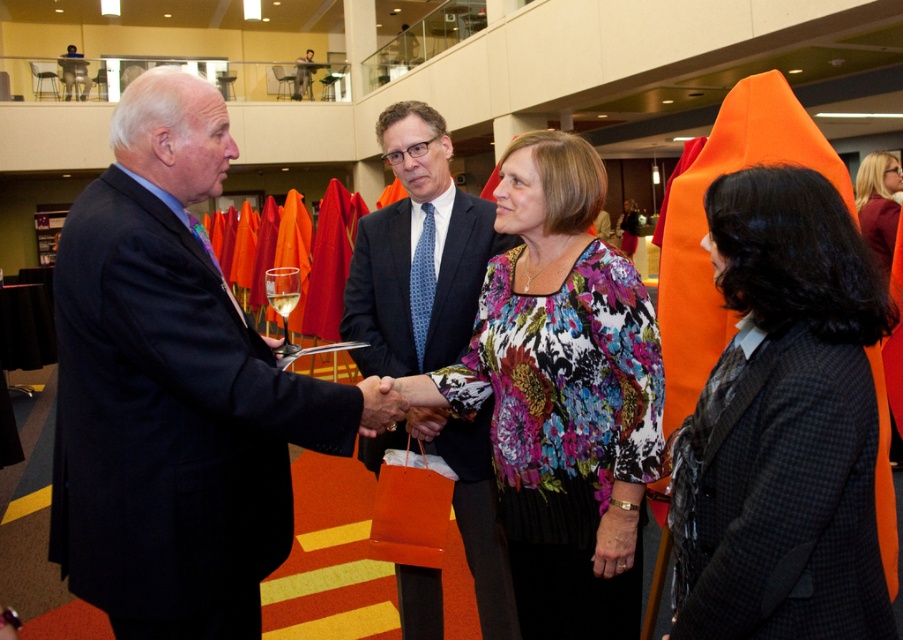
You are attending an event and see two people in the image. One is wearing a floral print blouse at center and the other has black textured hair at upper right. Which person is positioned lower in the image?

The floral print blouse at center is below black textured hair at upper right, so the person wearing the floral print blouse at center is positioned lower in the image.